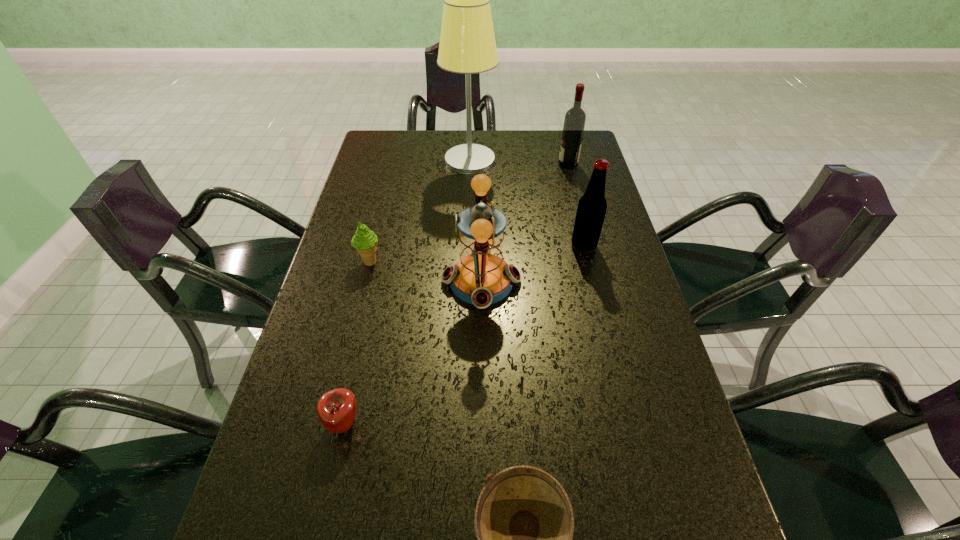
This screenshot has width=960, height=540. Find the location of `apple at the left edge`. apple at the left edge is located at coordinates pos(336,409).

You are a GUI agent. You are given a task and a screenshot of the screen. Output one action in this format:
    pyautogui.click(x=<x>, y=<y>)
    Task: Click on the alcohol present at the right edge
    The height and width of the screenshot is (540, 960).
    Given the screenshot: What is the action you would take?
    pyautogui.click(x=575, y=118)

This screenshot has width=960, height=540. I want to click on beer bottle that is at the right edge, so click(592, 206).

Locate an element on the screen. object that is at the far right corner is located at coordinates (575, 118).

The width and height of the screenshot is (960, 540). What are the coordinates of `free spot at the far edge of the desktop` in the screenshot? It's located at (492, 149).

In the image, there is a desktop. Where is `free space at the left edge`? The height and width of the screenshot is (540, 960). free space at the left edge is located at coordinates (388, 192).

I want to click on vacant space at the right edge, so click(644, 338).

In the image, there is a desktop. Find the location of `vacant space at the far left corner`. vacant space at the far left corner is located at coordinates (390, 162).

You are a GUI agent. You are given a task and a screenshot of the screen. Output one action in this format:
    pyautogui.click(x=<x>, y=<y>)
    Task: Click on the vacant space that is in between the beer bottle and the alcohol
    The image size is (960, 540).
    Given the screenshot: What is the action you would take?
    pyautogui.click(x=576, y=205)

Identify the location of free point between the table lamp and the icecream. [x=420, y=211].